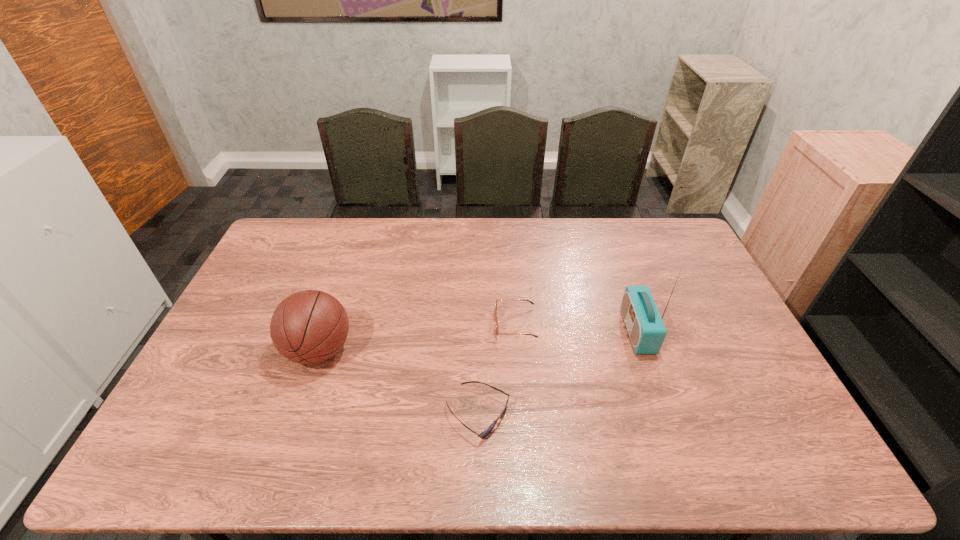
Locate an element on the screen. vacant region located 0.320m on the front panel of the radio receiver is located at coordinates (519, 331).

This screenshot has width=960, height=540. What are the coordinates of `free space located 0.400m on the back of the basketball` in the screenshot? It's located at (355, 245).

Locate an element on the screen. The width and height of the screenshot is (960, 540). vacant space situated 0.060m on the lenses of the taller sunglasses is located at coordinates (475, 323).

The width and height of the screenshot is (960, 540). I want to click on vacant region located on the lenses of the taller sunglasses, so click(x=466, y=323).

Image resolution: width=960 pixels, height=540 pixels. Identify the location of vacant space located on the lenses of the taller sunglasses. (449, 323).

Find the location of a particular element. This screenshot has width=960, height=540. vacant space located at the front of the nearer sunglasses showing the lenses is located at coordinates (564, 415).

At what (x,y) coordinates should I click in order to perform the action: click on object situated at the near edge. Please return your answer as a coordinate pair (x, y). Looking at the image, I should click on (482, 435).

Identify the location of vacant space at the far edge of the desktop. (504, 256).

Locate an element on the screen. Image resolution: width=960 pixels, height=540 pixels. vacant area at the near edge of the desktop is located at coordinates (397, 442).

In the image, there is a desktop. At what (x,y) coordinates should I click in order to perform the action: click on vacant space at the left edge. Please return your answer as a coordinate pair (x, y). Image resolution: width=960 pixels, height=540 pixels. Looking at the image, I should click on (264, 321).